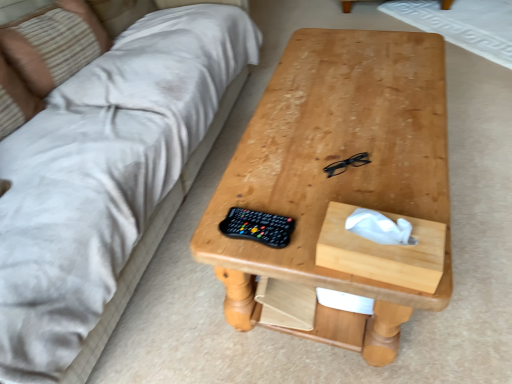
Locate an element on the screen. free space to the right of natural wood table at center is located at coordinates (479, 172).